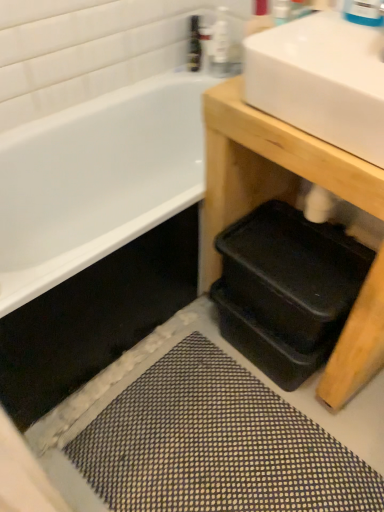
Where is `free space in front of translucent plastic bottle at upper center, which is counted as the first toiletry, starting from the left`? This screenshot has height=512, width=384. free space in front of translucent plastic bottle at upper center, which is counted as the first toiletry, starting from the left is located at coordinates (201, 80).